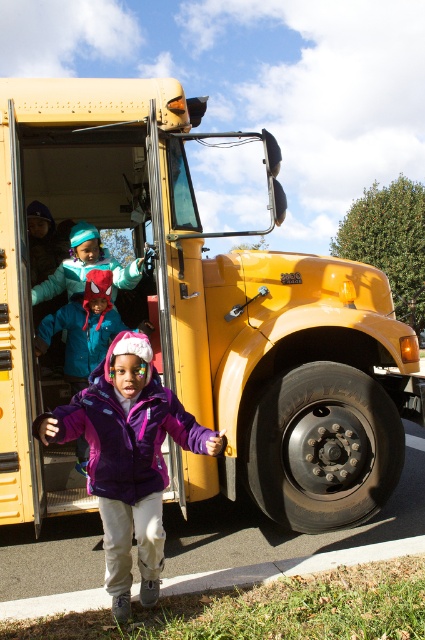
Question: Can you confirm if yellow matte school bus at center is positioned below purple fleece jacket at center?

Choices:
 (A) yes
 (B) no

Answer: (B)

Question: Is yellow matte school bus at center wider than purple fleece jacket at center?

Choices:
 (A) no
 (B) yes

Answer: (B)

Question: Among these points, which one is nearest to the camera?

Choices:
 (A) (16, 131)
 (B) (102, 464)

Answer: (B)

Question: Which point is farther to the camera?

Choices:
 (A) (42, 426)
 (B) (163, 365)

Answer: (B)

Question: In this image, where is yellow matte school bus at center located relative to purple fleece jacket at center?

Choices:
 (A) right
 (B) left

Answer: (A)